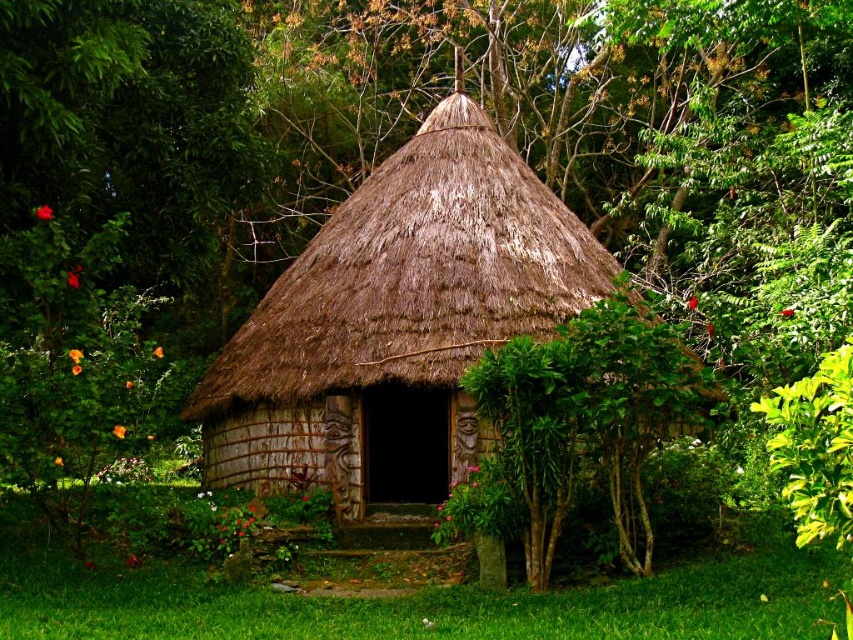
Question: Does brown thatched hut at center have a larger size compared to green leafy bush at center?

Choices:
 (A) yes
 (B) no

Answer: (A)

Question: Can you confirm if brown thatched hut at center is positioned to the left of green leafy bush at center?

Choices:
 (A) no
 (B) yes

Answer: (B)

Question: Among these objects, which one is nearest to the camera?

Choices:
 (A) green leafy bush at center
 (B) brown thatched hut at center

Answer: (A)

Question: Does brown thatched hut at center appear on the right side of green leafy bush at center?

Choices:
 (A) no
 (B) yes

Answer: (A)

Question: Which point is farther from the camera taking this photo?

Choices:
 (A) pos(689,371)
 (B) pos(506,161)

Answer: (B)